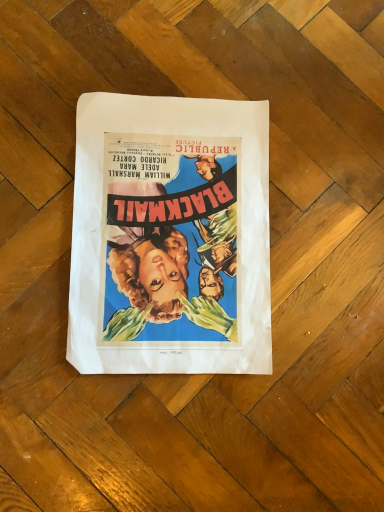
Question: Should I look upward or downward to see matte paper poster at center?

Choices:
 (A) down
 (B) up

Answer: (B)